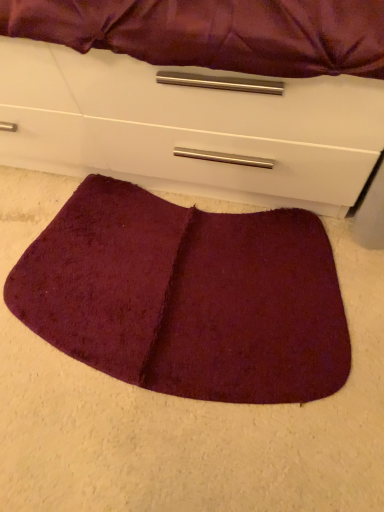
Question: Can you confirm if matte white chest of drawers at lower center is bigger than burgundy plush mat at lower center?

Choices:
 (A) no
 (B) yes

Answer: (B)

Question: Is matte white chest of drawers at lower center smaller than burgundy plush mat at lower center?

Choices:
 (A) yes
 (B) no

Answer: (B)

Question: From a real-world perspective, is matte white chest of drawers at lower center physically above burgundy plush mat at lower center?

Choices:
 (A) no
 (B) yes

Answer: (B)

Question: Is matte white chest of drawers at lower center looking in the opposite direction of burgundy plush mat at lower center?

Choices:
 (A) no
 (B) yes

Answer: (A)

Question: Is matte white chest of drawers at lower center directly adjacent to burgundy plush mat at lower center?

Choices:
 (A) yes
 (B) no

Answer: (B)

Question: Is matte white chest of drawers at lower center behind burgundy plush mat at lower center?

Choices:
 (A) yes
 (B) no

Answer: (B)

Question: Can you confirm if burgundy plush mat at lower center is wider than matte white chest of drawers at lower center?

Choices:
 (A) yes
 (B) no

Answer: (B)

Question: Is burgundy plush mat at lower center aimed at matte white chest of drawers at lower center?

Choices:
 (A) yes
 (B) no

Answer: (B)

Question: Can you confirm if burgundy plush mat at lower center is taller than matte white chest of drawers at lower center?

Choices:
 (A) no
 (B) yes

Answer: (A)

Question: Is burgundy plush mat at lower center outside matte white chest of drawers at lower center?

Choices:
 (A) yes
 (B) no

Answer: (A)

Question: From a real-world perspective, is burgundy plush mat at lower center physically above matte white chest of drawers at lower center?

Choices:
 (A) yes
 (B) no

Answer: (B)

Question: Can you see burgundy plush mat at lower center touching matte white chest of drawers at lower center?

Choices:
 (A) no
 (B) yes

Answer: (A)

Question: Considering the relative positions of burgundy plush mat at lower center and matte white chest of drawers at lower center in the image provided, is burgundy plush mat at lower center to the left or to the right of matte white chest of drawers at lower center?

Choices:
 (A) right
 (B) left

Answer: (A)